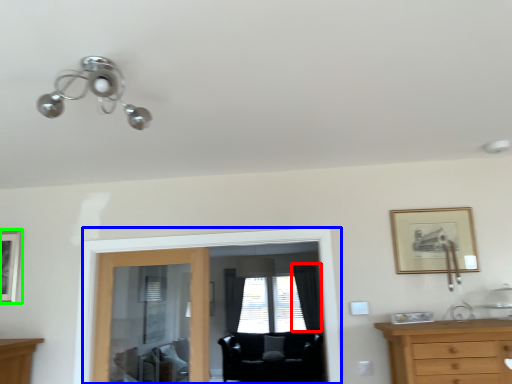
Question: Estimate the real-world distances between objects in this image. Which object is farther from curtain (highlighted by a red box), screen door (highlighted by a blue box) or picture frame (highlighted by a green box)?

Choices:
 (A) screen door
 (B) picture frame

Answer: (B)